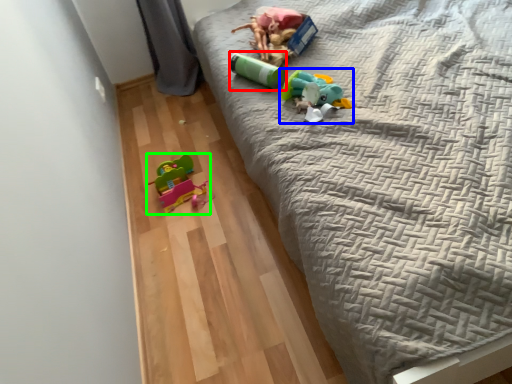
Question: Based on their relative distances, which object is nearer to toy (highlighted by a red box)? Choose from toy (highlighted by a blue box) and toy (highlighted by a green box).

Choices:
 (A) toy
 (B) toy

Answer: (A)